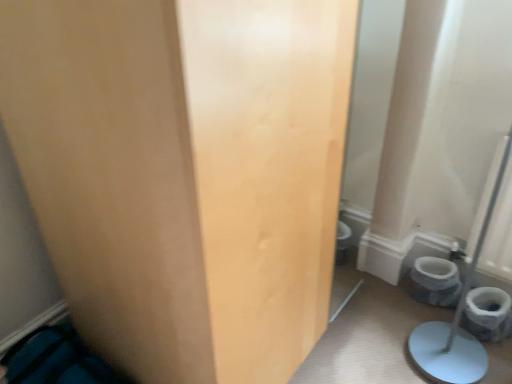
Describe the element at coordinates (435, 281) in the screenshot. I see `gray matte toilet bowl at lower right` at that location.

This screenshot has height=384, width=512. I want to click on gray matte toilet bowl at lower right, so click(435, 281).

What do you see at coordinates (185, 173) in the screenshot? I see `matte wood door at center` at bounding box center [185, 173].

You are a GUI agent. You are given a task and a screenshot of the screen. Output one action in this format:
    pyautogui.click(x=<x>, y=<y>)
    Task: Click on the matte wood door at center
    Image resolution: width=512 pixels, height=384 pixels.
    Given the screenshot: What is the action you would take?
    pyautogui.click(x=185, y=173)

Measure the distance between point (116, 171) and camera.

The distance of point (116, 171) from camera is 28.50 inches.

Measure the distance between matte wood door at center and camera.

matte wood door at center is 19.70 inches from camera.

The height and width of the screenshot is (384, 512). I want to click on gray matte toilet bowl at lower right, so coord(435,281).

Which object is positioned more to the left, matte wood door at center or gray matte toilet bowl at lower right?

From the viewer's perspective, matte wood door at center appears more on the left side.

Is matte wood door at center further to camera compared to gray matte toilet bowl at lower right?

No, matte wood door at center is closer to the camera.

Which is in front, point (216, 136) or point (449, 293)?

The point (216, 136) is in front.

From the image's perspective, which one is positioned higher, matte wood door at center or gray matte toilet bowl at lower right?

matte wood door at center.

From a real-world perspective, is matte wood door at center under gray matte toilet bowl at lower right?

No.

From the picture: Between matte wood door at center and gray matte toilet bowl at lower right, which one has smaller width?

gray matte toilet bowl at lower right.

Considering the sizes of objects matte wood door at center and gray matte toilet bowl at lower right in the image provided, who is taller, matte wood door at center or gray matte toilet bowl at lower right?

matte wood door at center.

Between matte wood door at center and gray matte toilet bowl at lower right, which one has smaller size?

gray matte toilet bowl at lower right is smaller.

Would you say matte wood door at center contains gray matte toilet bowl at lower right?

No, matte wood door at center does not contain gray matte toilet bowl at lower right.

Are matte wood door at center and gray matte toilet bowl at lower right far apart?

matte wood door at center is positioned a significant distance from gray matte toilet bowl at lower right.

Is matte wood door at center turned away from gray matte toilet bowl at lower right?

No.

Can you tell me how much matte wood door at center and gray matte toilet bowl at lower right differ in facing direction?

178 degrees separate the facing orientations of matte wood door at center and gray matte toilet bowl at lower right.

You are a GUI agent. You are given a task and a screenshot of the screen. Output one action in this format:
    pyautogui.click(x=<x>, y=<y>)
    Task: Click on the toilet bowl on the right side of matte wood door at center
    The image size is (512, 384).
    Given the screenshot: What is the action you would take?
    pyautogui.click(x=435, y=281)

Which object is positioned more to the left, gray matte toilet bowl at lower right or matte wood door at center?

From the viewer's perspective, matte wood door at center appears more on the left side.

In the image, is gray matte toilet bowl at lower right positioned in front of or behind matte wood door at center?

gray matte toilet bowl at lower right is behind matte wood door at center.

Which is less distant, (434,266) or (311,64)?

Point (434,266) is positioned farther from the camera compared to point (311,64).

From the image's perspective, between gray matte toilet bowl at lower right and matte wood door at center, who is located below?

gray matte toilet bowl at lower right.

From a real-world perspective, who is located higher, gray matte toilet bowl at lower right or matte wood door at center?

matte wood door at center.

Can you confirm if gray matte toilet bowl at lower right is wider than matte wood door at center?

In fact, gray matte toilet bowl at lower right might be narrower than matte wood door at center.

Who is shorter, gray matte toilet bowl at lower right or matte wood door at center?

With less height is gray matte toilet bowl at lower right.

Considering the sizes of objects gray matte toilet bowl at lower right and matte wood door at center in the image provided, who is bigger, gray matte toilet bowl at lower right or matte wood door at center?

matte wood door at center is bigger.

Can matte wood door at center be found inside gray matte toilet bowl at lower right?

No, matte wood door at center is not surrounded by gray matte toilet bowl at lower right.

Would you say gray matte toilet bowl at lower right is a long distance from matte wood door at center?

Absolutely, gray matte toilet bowl at lower right is distant from matte wood door at center.

Is gray matte toilet bowl at lower right aimed at matte wood door at center?

No, gray matte toilet bowl at lower right is not turned towards matte wood door at center.

Identify the location of toilet bowl on the right of matte wood door at center. (435, 281).

The width and height of the screenshot is (512, 384). In the image, there is a gray matte toilet bowl at lower right. Find the location of `door above it (from the image's perspective)`. door above it (from the image's perspective) is located at coordinates (185, 173).

Image resolution: width=512 pixels, height=384 pixels. What are the coordinates of `toilet bowl located on the right of matte wood door at center` in the screenshot? It's located at (435, 281).